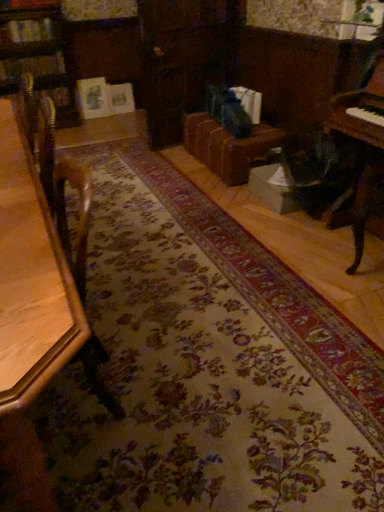
Question: Is wooden piano at right to the left or to the right of brown leather couch at center in the image?

Choices:
 (A) left
 (B) right

Answer: (B)

Question: In terms of size, does wooden piano at right appear bigger or smaller than brown leather couch at center?

Choices:
 (A) small
 (B) big

Answer: (A)

Question: Estimate the real-world distances between objects in this image. Which object is closer to the wooden piano at right?

Choices:
 (A) brown leather couch at center
 (B) wooden table at left

Answer: (A)

Question: Estimate the real-world distances between objects in this image. Which object is closer to the wooden piano at right?

Choices:
 (A) brown leather couch at center
 (B) wooden table at left

Answer: (A)